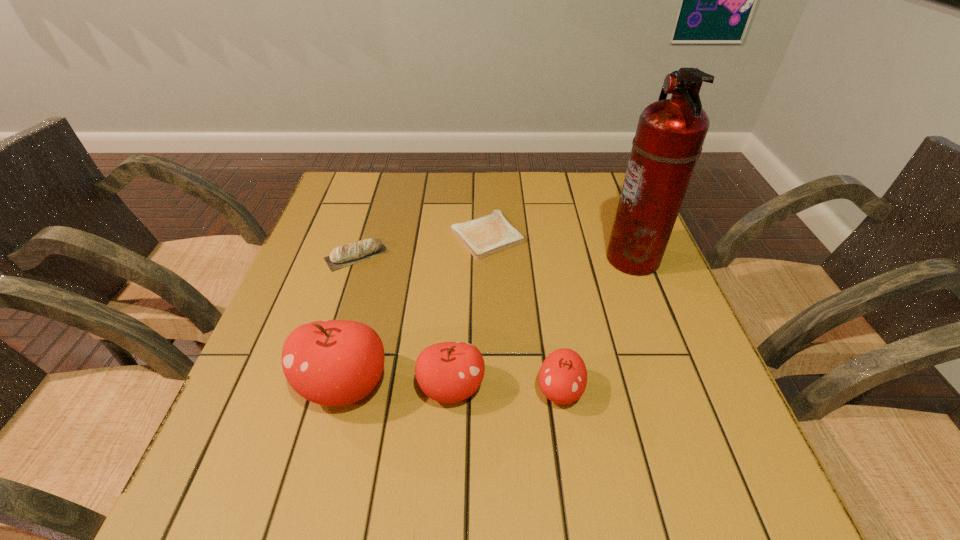
Given the evenly spaced apples in the image, where should an extra apple be added on the right to preserve the spacing? Please point to a vacant space. Please provide its 2D coordinates. Your answer should be formatted as a tuple, i.e. [(x, y)], where the tuple contains the x and y coordinates of a point satisfying the conditions above.

[(669, 394)]